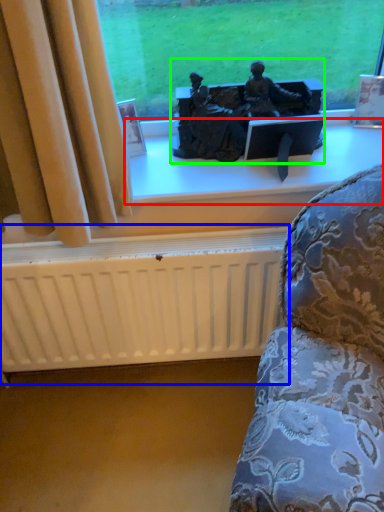
Question: Which object is positioned farthest from window sill (highlighted by a red box)? Select from radiator (highlighted by a blue box) and sculpture (highlighted by a green box).

Choices:
 (A) radiator
 (B) sculpture

Answer: (A)